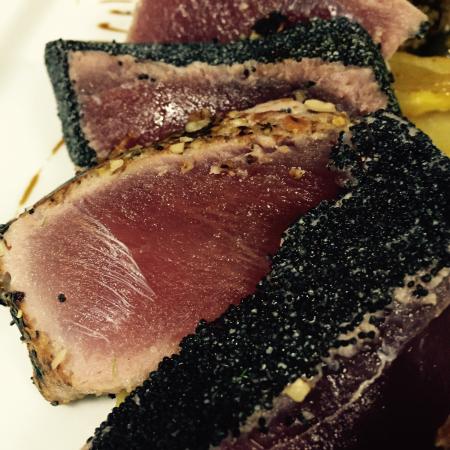
Where is `upper inner corner to the left`? upper inner corner to the left is located at coordinates (10, 11).